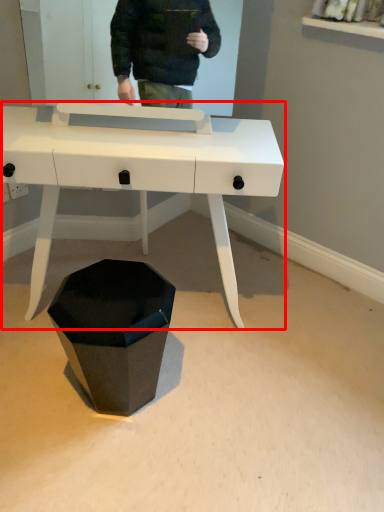
Question: From the image, what is the correct spatial relationship of desk (annotated by the red box) in relation to waste container?

Choices:
 (A) left
 (B) right

Answer: (B)